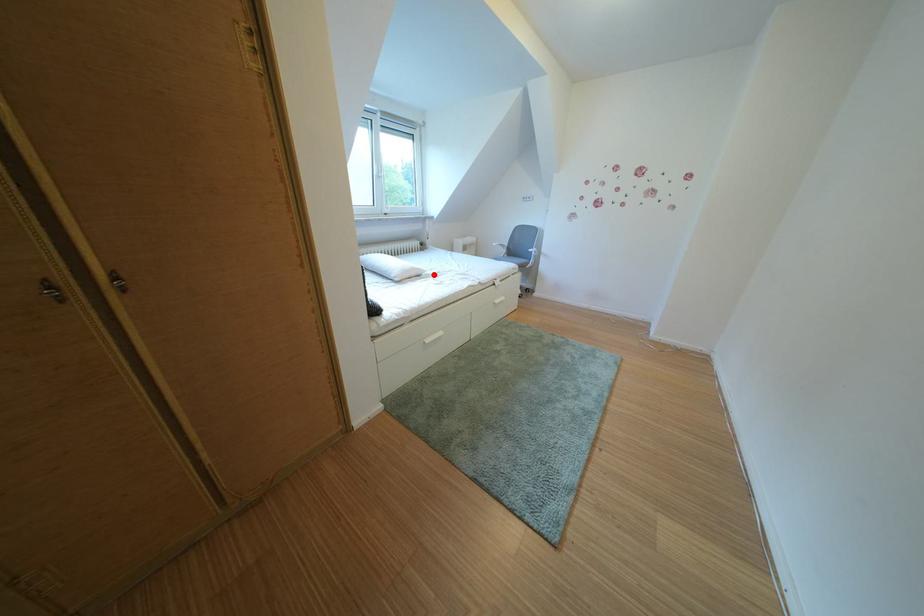
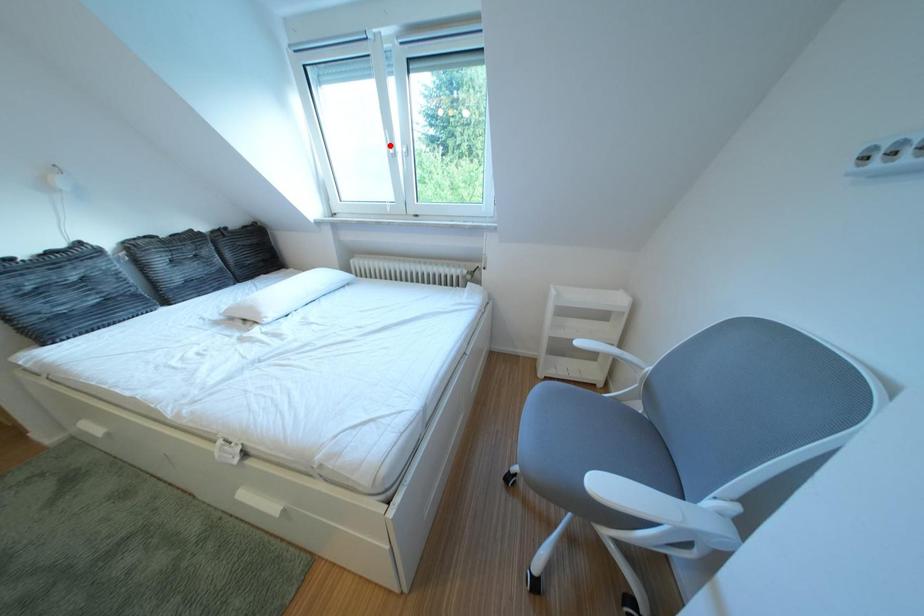
From the picture: I am providing you with two images of the same scene from different viewpoints. A red point is marked on the first image and another point is marked on the second image. Is the red point in image1 aligned with the point shown in image2?

No